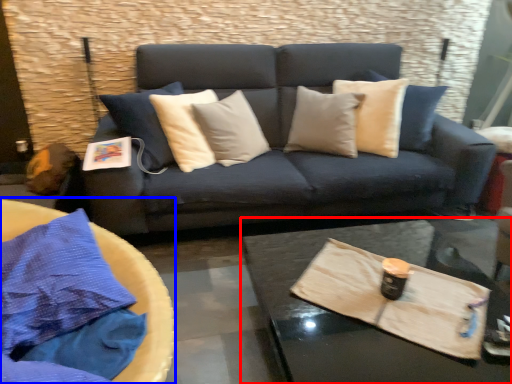
Question: Which point is closer to the camera, coffee table (highlighted by a red box) or round table (highlighted by a blue box)?

Choices:
 (A) coffee table
 (B) round table

Answer: (B)